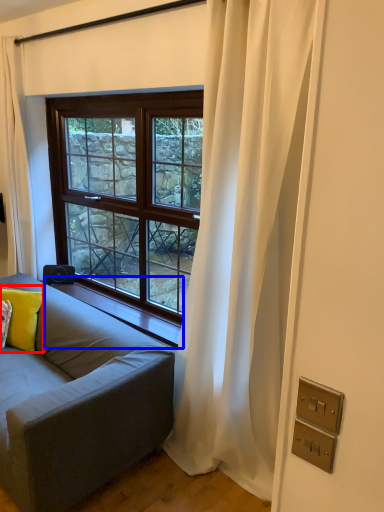
Question: Among these objects, which one is farthest to the camera, pillow (highlighted by a red box) or window sill (highlighted by a blue box)?

Choices:
 (A) pillow
 (B) window sill

Answer: (A)